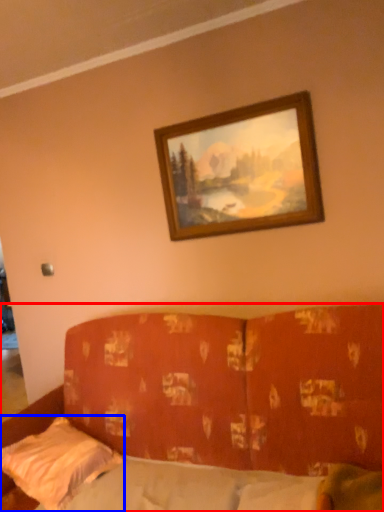
Question: Which object is further to the camera taking this photo, studio couch (highlighted by a red box) or pillow (highlighted by a blue box)?

Choices:
 (A) studio couch
 (B) pillow

Answer: (B)